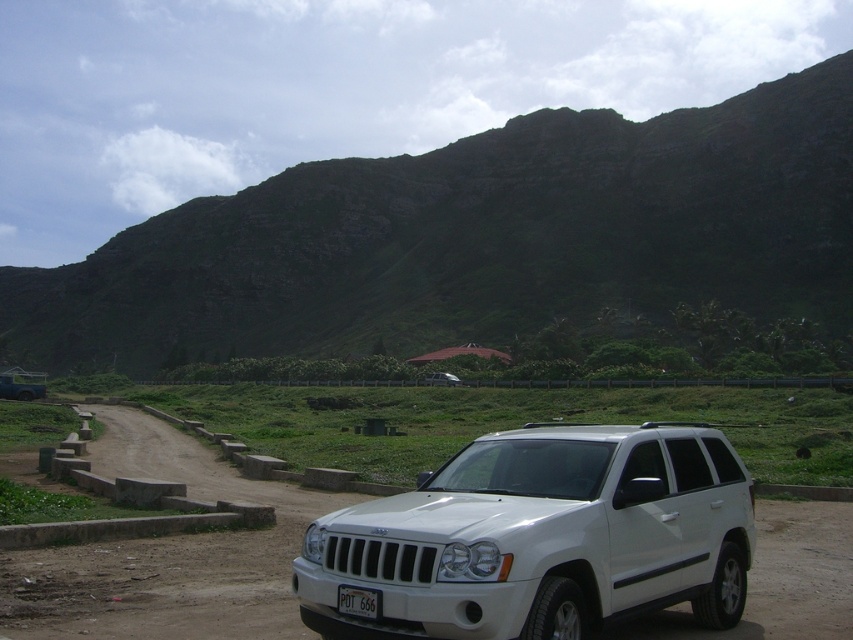
You are a driver who wants to know the position of the green rocky mountain at upper center relative to the white plastic license plate at center. From your perspective in the scene, which side of the license plate does the mountain appear on?

The green rocky mountain at upper center is positioned on the left side of the white plastic license plate at center.

You are standing in front of the white Jeep Grand Cherokee parked on a dirt road. Looking at the green rocky mountain at upper center, can you tell me the 2D coordinates of its position in the image?

The 2D coordinates of the green rocky mountain at upper center are at point (479, 237).